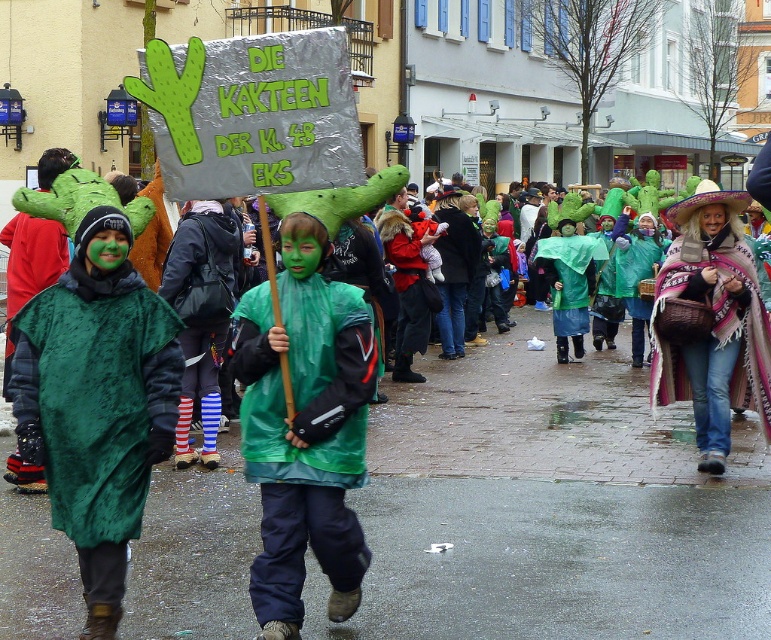
Does velvet green cape at center have a greater height compared to knitted woolen shawl at center?

No.

Can you confirm if velvet green cape at center is positioned below knitted woolen shawl at center?

Indeed, velvet green cape at center is positioned under knitted woolen shawl at center.

You are a GUI agent. You are given a task and a screenshot of the screen. Output one action in this format:
    pyautogui.click(x=<x>, y=<y>)
    Task: Click on the velvet green cape at center
    Image resolution: width=771 pixels, height=640 pixels.
    Given the screenshot: What is the action you would take?
    pyautogui.click(x=96, y=403)

Where is `velvet green cape at center`? velvet green cape at center is located at coordinates (96, 403).

Between knitted woolen shawl at center and rubber raincoat at center, which one appears on the left side from the viewer's perspective?

A: From the viewer's perspective, rubber raincoat at center appears more on the left side.

The width and height of the screenshot is (771, 640). In order to click on knitted woolen shawl at center in this screenshot , I will do `click(712, 323)`.

Measure the distance from velvet green cape at center to green shiny raincoat at center.

The distance of velvet green cape at center from green shiny raincoat at center is 21.80 inches.

Is velvet green cape at center wider than green shiny raincoat at center?

Yes, velvet green cape at center is wider than green shiny raincoat at center.

Locate an element on the screen. The image size is (771, 640). velvet green cape at center is located at coordinates (96, 403).